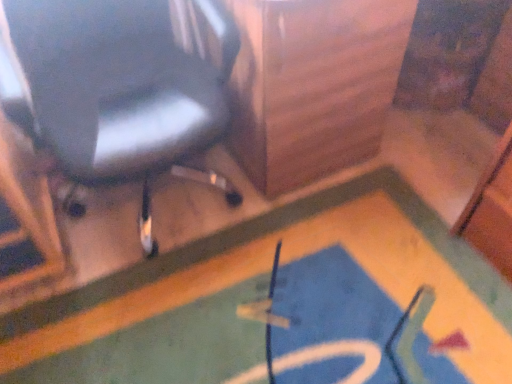
Question: From a real-world perspective, is matte black chair at upper left physically above blue carpet at lower center?

Choices:
 (A) no
 (B) yes

Answer: (B)

Question: Would you say matte black chair at upper left contains blue carpet at lower center?

Choices:
 (A) yes
 (B) no

Answer: (B)

Question: Considering the relative sizes of matte black chair at upper left and blue carpet at lower center in the image provided, is matte black chair at upper left bigger than blue carpet at lower center?

Choices:
 (A) yes
 (B) no

Answer: (A)

Question: Is matte black chair at upper left smaller than blue carpet at lower center?

Choices:
 (A) yes
 (B) no

Answer: (B)

Question: Does matte black chair at upper left touch blue carpet at lower center?

Choices:
 (A) yes
 (B) no

Answer: (B)

Question: Considering the relative positions of matte black chair at upper left and blue carpet at lower center in the image provided, is matte black chair at upper left to the left of blue carpet at lower center from the viewer's perspective?

Choices:
 (A) yes
 (B) no

Answer: (A)

Question: Is blue carpet at lower center facing away from matte black chair at upper left?

Choices:
 (A) no
 (B) yes

Answer: (A)

Question: From the image's perspective, is blue carpet at lower center located beneath matte black chair at upper left?

Choices:
 (A) no
 (B) yes

Answer: (B)

Question: Is the depth of blue carpet at lower center less than that of matte black chair at upper left?

Choices:
 (A) yes
 (B) no

Answer: (B)

Question: Does blue carpet at lower center have a lesser width compared to matte black chair at upper left?

Choices:
 (A) no
 (B) yes

Answer: (A)

Question: Does blue carpet at lower center appear on the right side of matte black chair at upper left?

Choices:
 (A) yes
 (B) no

Answer: (A)

Question: Is blue carpet at lower center not close to matte black chair at upper left?

Choices:
 (A) no
 (B) yes

Answer: (A)

Question: Is matte black chair at upper left taller or shorter than blue carpet at lower center?

Choices:
 (A) tall
 (B) short

Answer: (A)